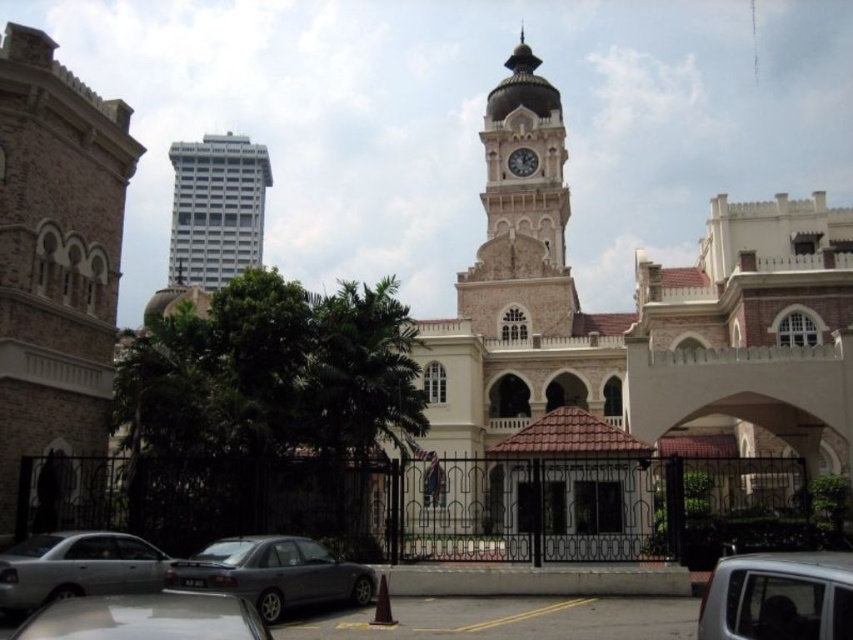
Question: Which object is the farthest from the white glossy building at upper left?

Choices:
 (A) brown stone tower at left
 (B) silver metallic car at lower left
 (C) white glossy car at lower left
 (D) white stone clock at center

Answer: (B)

Question: Which point is closer to the camera?

Choices:
 (A) silver metallic car at lower right
 (B) brown stone clock tower at center

Answer: (A)

Question: Is silver metallic car at lower right further to the viewer compared to silver metallic car at lower left?

Choices:
 (A) yes
 (B) no

Answer: (B)

Question: Can you confirm if brown stone clock tower at center is positioned below silver metallic car at lower right?

Choices:
 (A) yes
 (B) no

Answer: (B)

Question: Is silver metallic car at lower right wider than white stone clock at center?

Choices:
 (A) no
 (B) yes

Answer: (B)

Question: Which point appears closest to the camera in this image?

Choices:
 (A) (521, 148)
 (B) (723, 620)

Answer: (B)